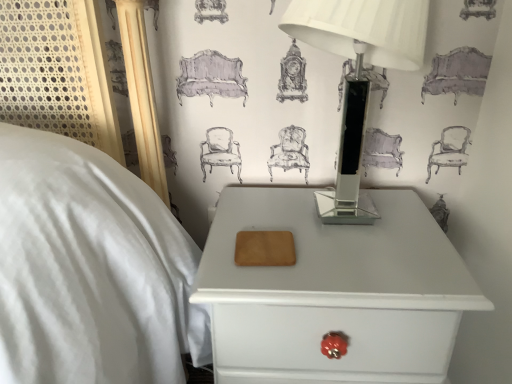
The height and width of the screenshot is (384, 512). Find the location of `blank space situated above white glossy nightstand at lower right (from a real-world perspective)`. blank space situated above white glossy nightstand at lower right (from a real-world perspective) is located at coordinates (331, 233).